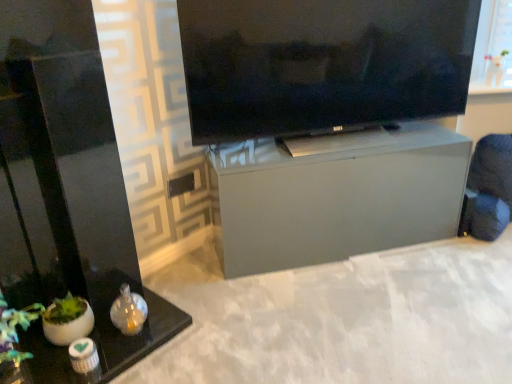
Question: Is black glass table at lower left, acting as the first furniture starting from the left, to the right of matte black tv at upper center from the viewer's perspective?

Choices:
 (A) no
 (B) yes

Answer: (A)

Question: Does black glass table at lower left, acting as the first furniture starting from the left, have a lesser height compared to matte black tv at upper center?

Choices:
 (A) no
 (B) yes

Answer: (A)

Question: Is matte black tv at upper center located within black glass table at lower left, acting as the first furniture starting from the left?

Choices:
 (A) no
 (B) yes

Answer: (A)

Question: From a real-world perspective, is black glass table at lower left, acting as the first furniture starting from the left, under matte black tv at upper center?

Choices:
 (A) no
 (B) yes

Answer: (B)

Question: Does black glass table at lower left, acting as the first furniture starting from the left, have a greater width compared to matte black tv at upper center?

Choices:
 (A) yes
 (B) no

Answer: (A)

Question: Is black glass table at lower left, the 2th furniture when ordered from right to left, oriented towards matte black tv at upper center?

Choices:
 (A) no
 (B) yes

Answer: (A)

Question: From the image's perspective, does black glass table at lower left, arranged as the first furniture when viewed from the front, appear lower than satin gray cabinet at center, the first furniture when ordered from right to left?

Choices:
 (A) no
 (B) yes

Answer: (B)

Question: Is black glass table at lower left, acting as the first furniture starting from the left, closer to the viewer compared to satin gray cabinet at center, which is the second furniture from left to right?

Choices:
 (A) no
 (B) yes

Answer: (B)

Question: Considering the relative sizes of black glass table at lower left, marked as the 2th furniture in a back-to-front arrangement, and satin gray cabinet at center, which is the second furniture from left to right, in the image provided, is black glass table at lower left, marked as the 2th furniture in a back-to-front arrangement, taller than satin gray cabinet at center, which is the second furniture from left to right,?

Choices:
 (A) yes
 (B) no

Answer: (A)

Question: Does black glass table at lower left, acting as the first furniture starting from the left, have a smaller size compared to satin gray cabinet at center, the second furniture from the front?

Choices:
 (A) no
 (B) yes

Answer: (A)

Question: From a real-world perspective, is black glass table at lower left, marked as the 2th furniture in a back-to-front arrangement, on satin gray cabinet at center, the first furniture when ordered from right to left?

Choices:
 (A) no
 (B) yes

Answer: (B)

Question: Is black glass table at lower left, the 2th furniture when ordered from right to left, wider than satin gray cabinet at center, which is the second furniture from left to right?

Choices:
 (A) no
 (B) yes

Answer: (B)

Question: Does satin gray cabinet at center, the first furniture when ordered from right to left, turn towards black glass table at lower left, acting as the first furniture starting from the left?

Choices:
 (A) no
 (B) yes

Answer: (A)